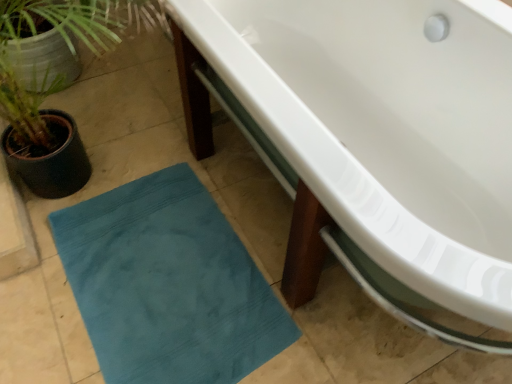
Question: Is teal fabric bath mat at lower left surrounded by white glossy bathtub at center?

Choices:
 (A) yes
 (B) no

Answer: (B)

Question: Can you confirm if white glossy bathtub at center is thinner than teal fabric bath mat at lower left?

Choices:
 (A) no
 (B) yes

Answer: (A)

Question: Does white glossy bathtub at center come behind teal fabric bath mat at lower left?

Choices:
 (A) no
 (B) yes

Answer: (A)

Question: Can you confirm if white glossy bathtub at center is smaller than teal fabric bath mat at lower left?

Choices:
 (A) yes
 (B) no

Answer: (B)

Question: Is white glossy bathtub at center oriented towards teal fabric bath mat at lower left?

Choices:
 (A) yes
 (B) no

Answer: (A)

Question: Visually, is teal fabric bath mat at lower left positioned to the left or to the right of white glossy bathtub at center?

Choices:
 (A) right
 (B) left

Answer: (B)

Question: Is teal fabric bath mat at lower left inside the boundaries of white glossy bathtub at center, or outside?

Choices:
 (A) inside
 (B) outside

Answer: (B)

Question: Is teal fabric bath mat at lower left bigger or smaller than white glossy bathtub at center?

Choices:
 (A) big
 (B) small

Answer: (B)

Question: Is teal fabric bath mat at lower left wider or thinner than white glossy bathtub at center?

Choices:
 (A) wide
 (B) thin

Answer: (B)

Question: From the image's perspective, is teal fabric bath mat at lower left above or below green textured plant at left?

Choices:
 (A) below
 (B) above

Answer: (A)

Question: Looking at their shapes, would you say teal fabric bath mat at lower left is wider or thinner than green textured plant at left?

Choices:
 (A) wide
 (B) thin

Answer: (B)

Question: From their relative heights in the image, would you say teal fabric bath mat at lower left is taller or shorter than green textured plant at left?

Choices:
 (A) short
 (B) tall

Answer: (A)

Question: Is teal fabric bath mat at lower left spatially inside green textured plant at left, or outside of it?

Choices:
 (A) inside
 (B) outside

Answer: (B)

Question: Is white glossy bathtub at center bigger or smaller than green textured plant at left?

Choices:
 (A) small
 (B) big

Answer: (B)

Question: Is white glossy bathtub at center taller or shorter than green textured plant at left?

Choices:
 (A) short
 (B) tall

Answer: (A)